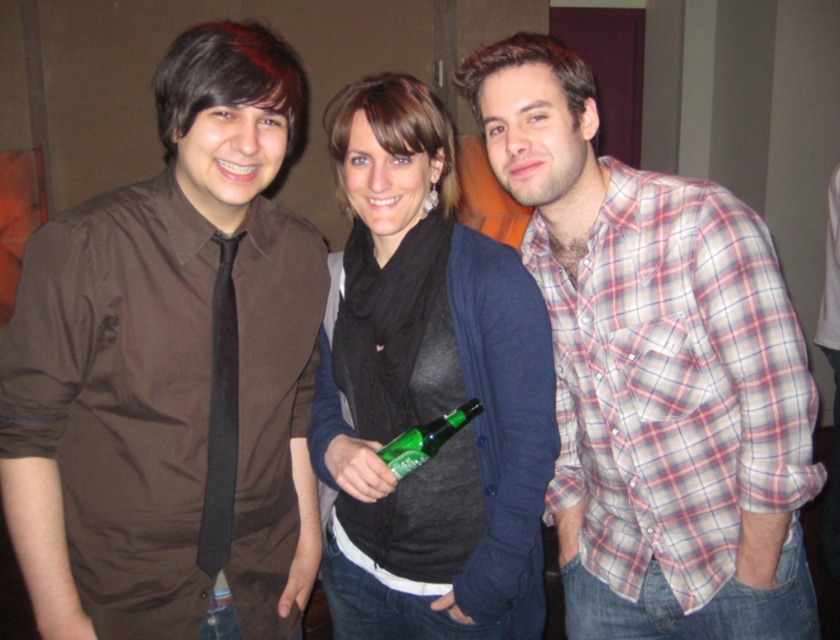
Is matte brown shirt at left to the left of green glass bottle at center from the viewer's perspective?

Correct, you'll find matte brown shirt at left to the left of green glass bottle at center.

Measure the distance between point (287, 300) and camera.

They are 4.44 feet apart.

Is point (197, 544) behind point (408, 470)?

No, it is not.

The image size is (840, 640). In order to click on matte brown shirt at left in this screenshot , I will do `click(172, 372)`.

Which is more to the left, plaid cotton shirt at center or green glass bottle at center?

green glass bottle at center is more to the left.

Who is shorter, plaid cotton shirt at center or green glass bottle at center?

Standing shorter between the two is green glass bottle at center.

Which is behind, point (741, 305) or point (424, 442)?

Positioned behind is point (424, 442).

Locate an element on the screen. The height and width of the screenshot is (640, 840). plaid cotton shirt at center is located at coordinates (655, 372).

Measure the distance between plaid cotton shirt at center and matte black scarf at center.

plaid cotton shirt at center is 7.92 inches from matte black scarf at center.

Measure the distance between plaid cotton shirt at center and camera.

They are 1.17 meters apart.

Describe the element at coordinates (655, 372) in the screenshot. I see `plaid cotton shirt at center` at that location.

You are a GUI agent. You are given a task and a screenshot of the screen. Output one action in this format:
    pyautogui.click(x=<x>, y=<y>)
    Task: Click on the plaid cotton shirt at center
    The image size is (840, 640).
    Given the screenshot: What is the action you would take?
    pyautogui.click(x=655, y=372)